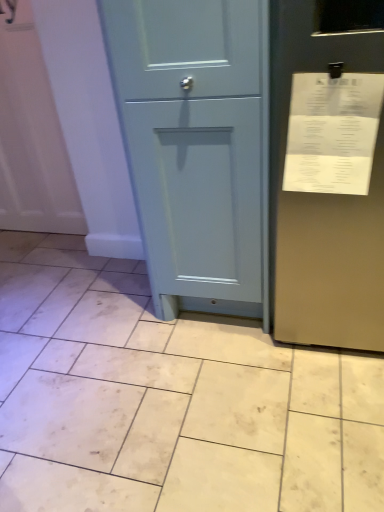
Question: In the image, is white glossy tile at lower left, acting as the second ceramic tile starting from the bottom, on the left side or the right side of white paper receipt at upper right?

Choices:
 (A) right
 (B) left

Answer: (B)

Question: Which is correct: white glossy tile at lower left, which is the 1th ceramic tile from top to bottom, is inside white paper receipt at upper right, or outside of it?

Choices:
 (A) outside
 (B) inside

Answer: (A)

Question: Which is farther from the white paper receipt at upper right?

Choices:
 (A) white glossy tile at lower left, acting as the second ceramic tile starting from the bottom
 (B) beige matte tile at center, which is counted as the second ceramic tile, starting from the top
 (C) matte blue cabinet at center

Answer: (A)

Question: Based on their relative distances, which object is farther from the beige matte tile at center, which is counted as the second ceramic tile, starting from the top?

Choices:
 (A) matte blue cabinet at center
 (B) white paper receipt at upper right
 (C) white glossy tile at lower left, which is the 1th ceramic tile from top to bottom

Answer: (C)